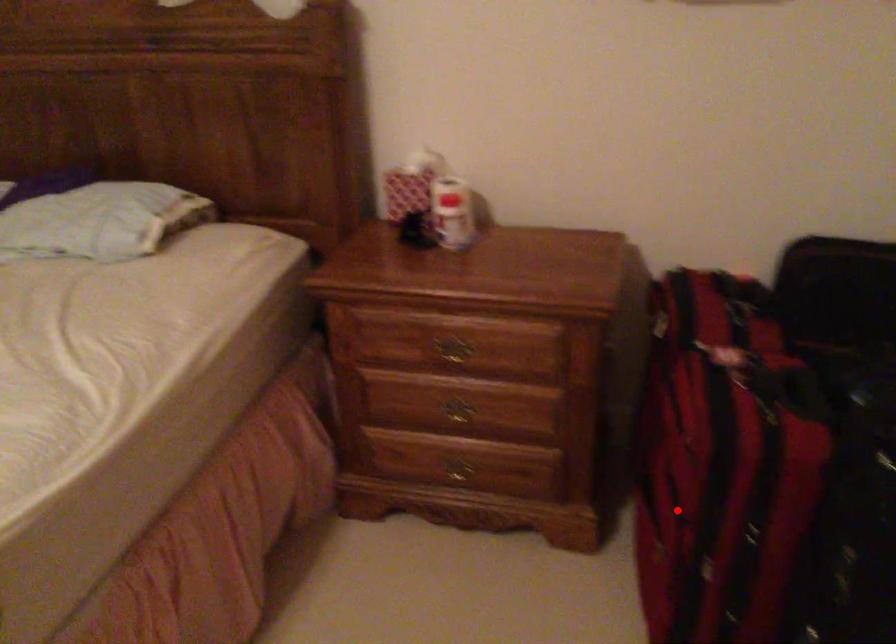
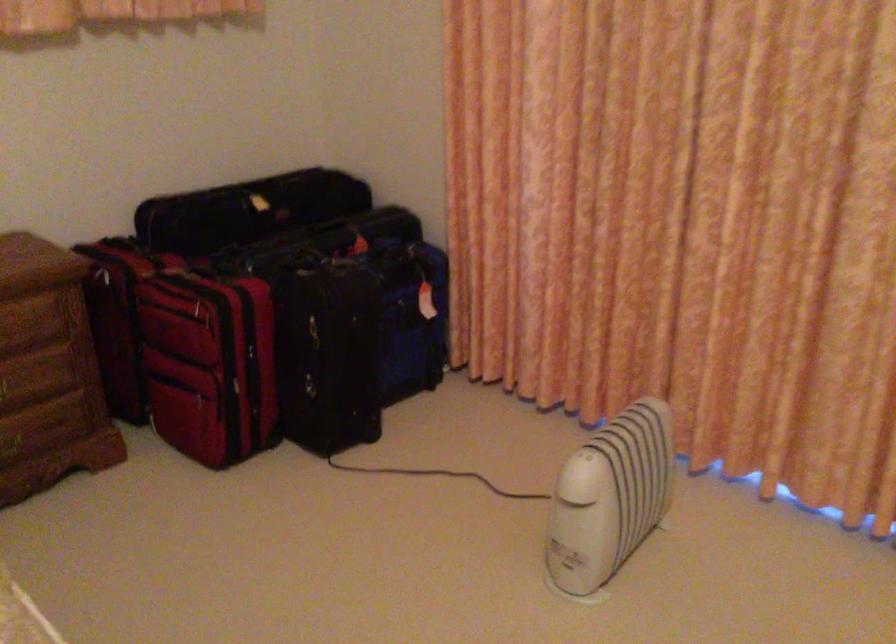
Question: I am providing you with two images of the same scene from different viewpoints. Image1 has a red point marked. In image2, the corresponding 3D location appears at what relative position? Reply with the corresponding letter.

Choices:
 (A) Closer
 (B) Farther

Answer: (B)